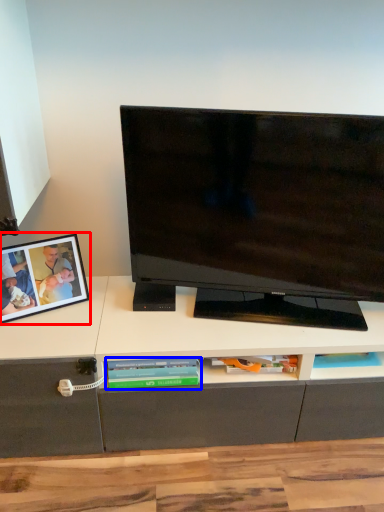
Question: Among these objects, which one is farthest to the camera, picture frame (highlighted by a red box) or book (highlighted by a blue box)?

Choices:
 (A) picture frame
 (B) book

Answer: (B)